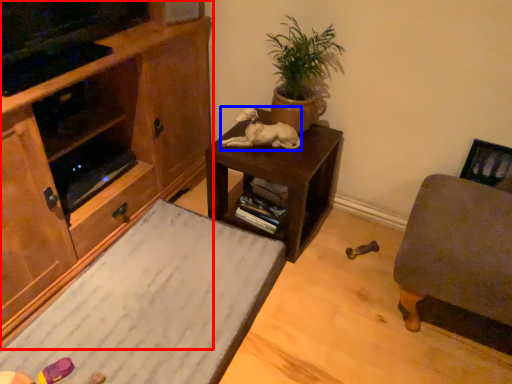
Question: Which object is further to the camera taking this photo, cabinetry (highlighted by a red box) or animal (highlighted by a blue box)?

Choices:
 (A) cabinetry
 (B) animal

Answer: (B)